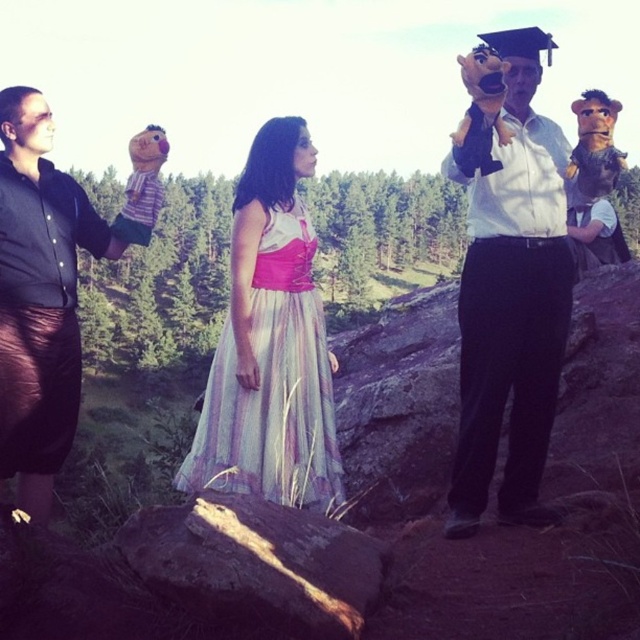
Question: Which of the following is the closest to the observer?

Choices:
 (A) (525, 42)
 (B) (22, 282)

Answer: (B)

Question: Does white shirt at center have a greater width compared to rusty metallic log at center?

Choices:
 (A) yes
 (B) no

Answer: (B)

Question: Is white shirt at center to the left of matte black glove at left from the viewer's perspective?

Choices:
 (A) yes
 (B) no

Answer: (B)

Question: Is matte black glove at left positioned behind pastel chiffon dress at center?

Choices:
 (A) no
 (B) yes

Answer: (A)

Question: Among these objects, which one is farthest from the camera?

Choices:
 (A) rusty metallic log at center
 (B) pastel chiffon dress at center
 (C) matte black glove at left
 (D) white shirt at center

Answer: (B)

Question: Which object is positioned farthest from the pastel chiffon dress at center?

Choices:
 (A) white shirt at center
 (B) rusty metallic log at center
 (C) matte black glove at left

Answer: (A)